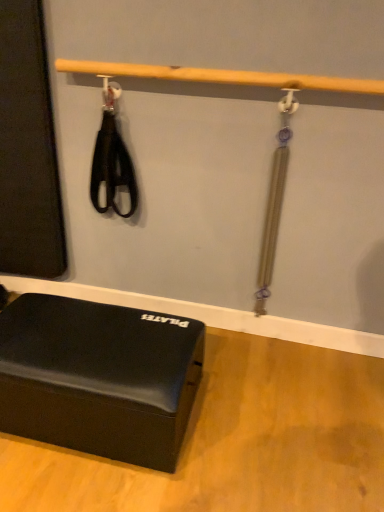
Identify the location of blank space above matte black foam block at lower left (from a real-world perspective). (92, 337).